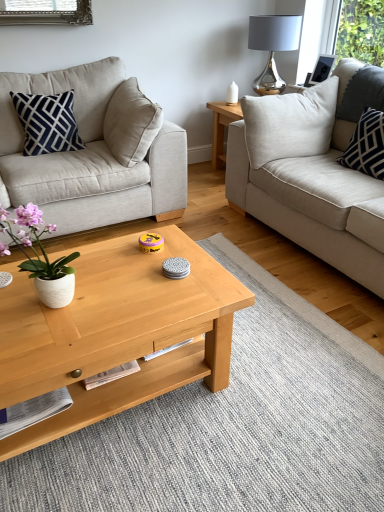
Identify the location of vacant area to the right of light wood/texture coffee table at center. The image size is (384, 512). (280, 395).